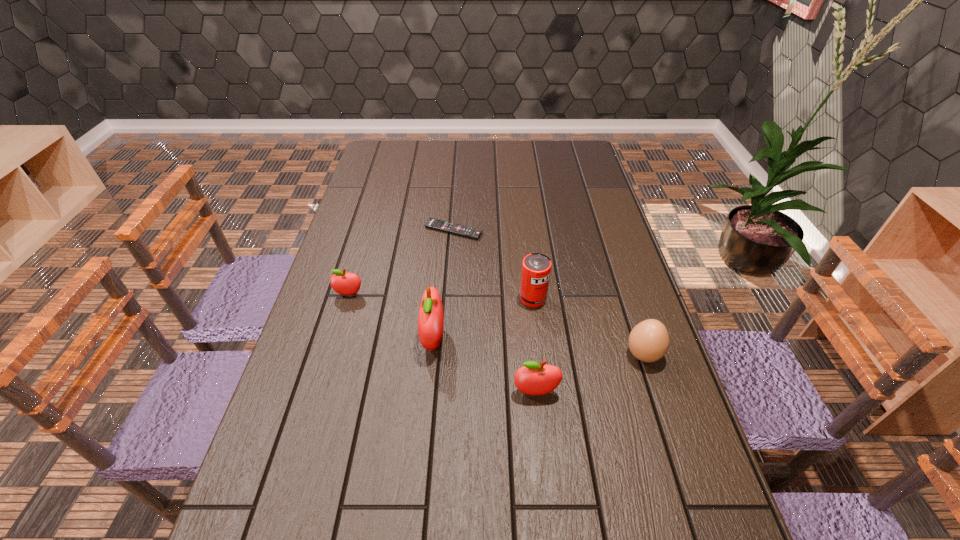
Identify the location of vacant region at the left edge of the desktop. This screenshot has width=960, height=540. (309, 321).

At what (x,y) coordinates should I click in order to perform the action: click on vacant area at the right edge of the desktop. Please return your answer as a coordinate pair (x, y). The height and width of the screenshot is (540, 960). Looking at the image, I should click on (577, 193).

Locate an element on the screen. This screenshot has width=960, height=540. blank space at the far left corner of the desktop is located at coordinates (399, 153).

At what (x,y) coordinates should I click in order to perform the action: click on vacant area at the far right corner. Please return your answer as a coordinate pair (x, y). Image resolution: width=960 pixels, height=540 pixels. Looking at the image, I should click on (583, 165).

Image resolution: width=960 pixels, height=540 pixels. Find the location of `vacant point at the near right corner`. vacant point at the near right corner is located at coordinates (677, 518).

I want to click on free spot between the rightmost apple and the farthest object, so click(494, 312).

Identify the location of free space between the rightmost object and the nearest object. (589, 374).

At what (x,y) coordinates should I click in order to perform the action: click on free space between the shortest object and the leftmost object. Please return your answer as a coordinate pair (x, y). This screenshot has height=540, width=960. Looking at the image, I should click on pos(401,262).

Where is `free space that is in between the can and the boiled egg`? free space that is in between the can and the boiled egg is located at coordinates (588, 327).

This screenshot has width=960, height=540. In order to click on vacant area that lies between the shortest object and the nearest object in this screenshot , I will do `click(494, 312)`.